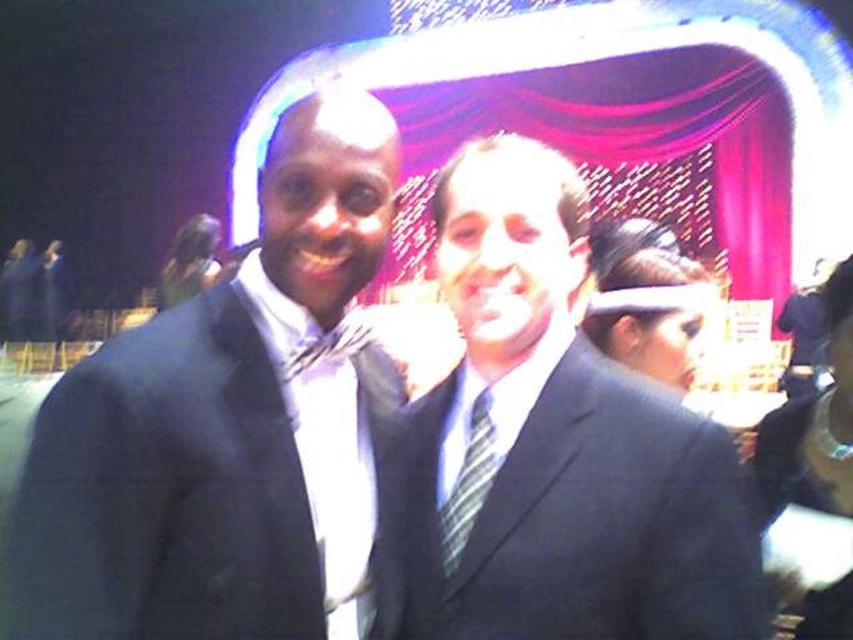
You are a photographer adjusting the focus on your camera. You need to ensure that both the matte black suit at center and the striped fabric tie at center are in focus. Given their sizes, which object should you prioritize focusing on first to ensure clarity?

The matte black suit at center is bigger than striped fabric tie at center, so you should prioritize focusing on the matte black suit at center first because larger objects often require more precise focus adjustments to ensure all parts are sharp.

Where is the matte black suit at left located in the image?

The matte black suit at left is located at point (223, 429) in the image.